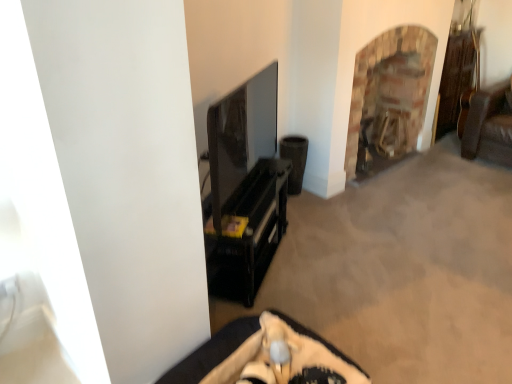
Question: Considering the relative sizes of brown woven speaker at center-right and black glossy tv stand at center, positioned as the 1th furniture in top-to-bottom order, in the image provided, is brown woven speaker at center-right bigger than black glossy tv stand at center, positioned as the 1th furniture in top-to-bottom order,?

Choices:
 (A) yes
 (B) no

Answer: (B)

Question: Can you confirm if brown woven speaker at center-right is smaller than black glossy tv stand at center, placed as the 2th furniture when sorted from front to back?

Choices:
 (A) no
 (B) yes

Answer: (B)

Question: From a real-world perspective, is brown woven speaker at center-right below black glossy tv stand at center, the first furniture viewed from the back?

Choices:
 (A) no
 (B) yes

Answer: (B)

Question: Is brown woven speaker at center-right with black glossy tv stand at center, the 2th furniture from the bottom?

Choices:
 (A) no
 (B) yes

Answer: (A)

Question: Considering the relative sizes of brown woven speaker at center-right and black glossy tv stand at center, the first furniture viewed from the back, in the image provided, is brown woven speaker at center-right taller than black glossy tv stand at center, the first furniture viewed from the back,?

Choices:
 (A) no
 (B) yes

Answer: (A)

Question: From the image's perspective, is black glossy tv stand at center, the 2th furniture from the bottom, above or below brown woven speaker at center-right?

Choices:
 (A) below
 (B) above

Answer: (A)

Question: Considering the positions of black glossy tv stand at center, positioned as the 1th furniture in top-to-bottom order, and brown woven speaker at center-right in the image, is black glossy tv stand at center, positioned as the 1th furniture in top-to-bottom order, wider or thinner than brown woven speaker at center-right?

Choices:
 (A) wide
 (B) thin

Answer: (A)

Question: Considering the positions of point (284, 215) and point (295, 180), is point (284, 215) closer or farther from the camera than point (295, 180)?

Choices:
 (A) farther
 (B) closer

Answer: (B)

Question: Is black glossy tv stand at center, placed as the 2th furniture when sorted from front to back, situated inside brown woven speaker at center-right or outside?

Choices:
 (A) outside
 (B) inside

Answer: (A)

Question: Is black glossy tv stand at center, the first furniture viewed from the back, situated inside brick fireplace at upper right or outside?

Choices:
 (A) outside
 (B) inside

Answer: (A)

Question: Relative to brick fireplace at upper right, is black glossy tv stand at center, placed as the 2th furniture when sorted from front to back, in front or behind?

Choices:
 (A) front
 (B) behind

Answer: (A)

Question: Is black glossy tv stand at center, placed as the 2th furniture when sorted from front to back, taller or shorter than brick fireplace at upper right?

Choices:
 (A) short
 (B) tall

Answer: (A)

Question: Is point (284, 172) closer or farther from the camera than point (421, 29)?

Choices:
 (A) closer
 (B) farther

Answer: (A)

Question: Relative to beige fabric cushion at lower center, arranged as the 2th furniture when viewed from the top, is brown woven speaker at center-right in front or behind?

Choices:
 (A) front
 (B) behind

Answer: (B)

Question: In terms of width, does brown woven speaker at center-right look wider or thinner when compared to beige fabric cushion at lower center, arranged as the 2th furniture when viewed from the top?

Choices:
 (A) wide
 (B) thin

Answer: (B)